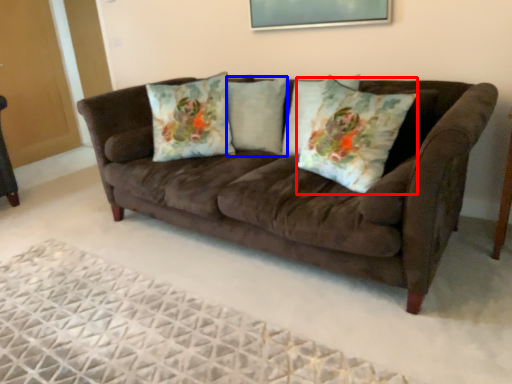
Question: Which object is further to the camera taking this photo, throw pillow (highlighted by a red box) or pillow (highlighted by a blue box)?

Choices:
 (A) throw pillow
 (B) pillow

Answer: (B)